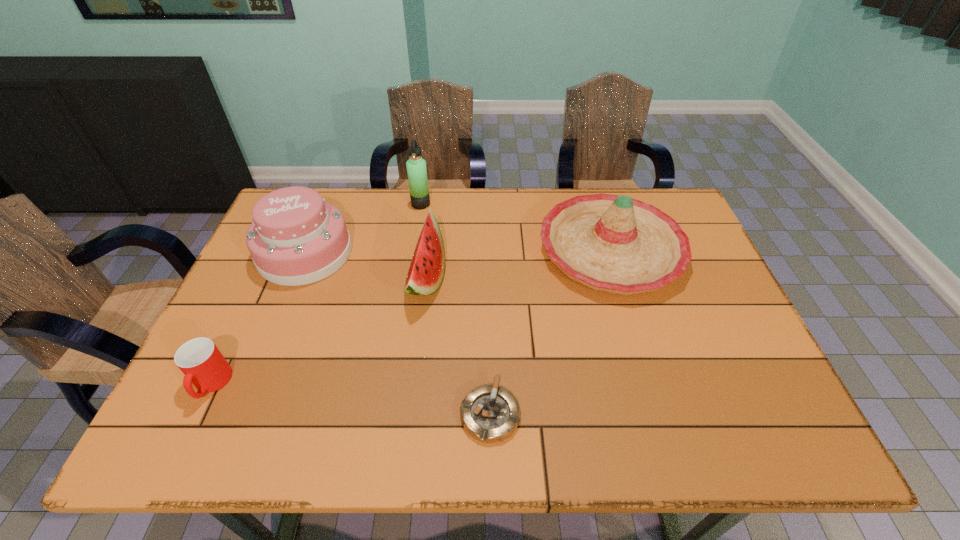
This screenshot has height=540, width=960. I want to click on free space located 0.140m on the outer rind of the watermelon, so click(495, 279).

Identify the location of free space located 0.070m on the side of the second shortest object with the handle. (185, 438).

What are the coordinates of `free space located 0.400m on the back of the second object from right to left` in the screenshot? It's located at (488, 261).

Image resolution: width=960 pixels, height=540 pixels. Identify the location of thermos bottle located at the far edge. (416, 166).

Identify the location of sombrero located at the far edge. (616, 244).

Identify the location of cake that is at the far edge. The image size is (960, 540). (296, 238).

Locate an element on the screen. The height and width of the screenshot is (540, 960). object situated at the near edge is located at coordinates (490, 413).

Identify the location of cake that is at the left edge. The height and width of the screenshot is (540, 960). (296, 238).

This screenshot has width=960, height=540. Identify the location of cup located at the left edge. (203, 365).

This screenshot has width=960, height=540. Identify the location of object present at the right edge. (616, 244).